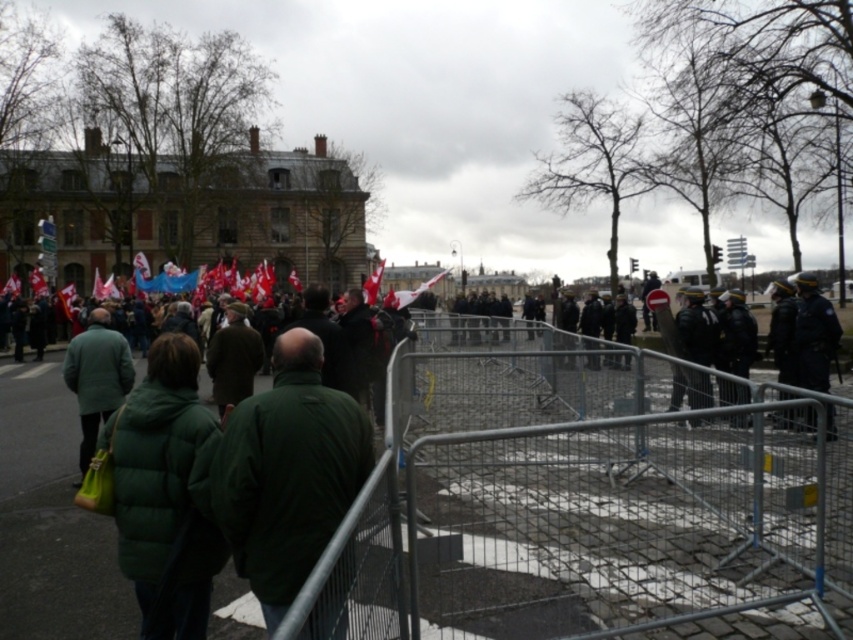
Who is shorter, metallic silver fence at center or green puffy coat at center?

Standing shorter between the two is green puffy coat at center.

Looking at this image, can you confirm if metallic silver fence at center is positioned to the left of green puffy coat at center?

In fact, metallic silver fence at center is to the right of green puffy coat at center.

Where is `metallic silver fence at center`? This screenshot has height=640, width=853. metallic silver fence at center is located at coordinates (581, 497).

I want to click on green matte jacket at center, so click(288, 472).

Identify the location of green matte jacket at center. This screenshot has height=640, width=853. (288, 472).

Identify the location of green matte jacket at center. This screenshot has width=853, height=640. (288, 472).

Does metallic silver fence at center appear on the right side of green matte jacket at left?

Yes, metallic silver fence at center is to the right of green matte jacket at left.

Can you confirm if metallic silver fence at center is smaller than green matte jacket at left?

Yes.

Who is more distant from viewer, (711, 468) or (119, 364)?

Point (711, 468)

Where is `metallic silver fence at center`? The image size is (853, 640). metallic silver fence at center is located at coordinates [581, 497].